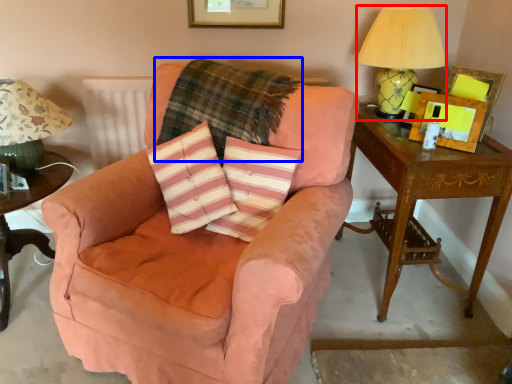
Question: Which of the following is the closest to the observer, table lamp (highlighted by a red box) or plaid (highlighted by a blue box)?

Choices:
 (A) table lamp
 (B) plaid

Answer: (B)